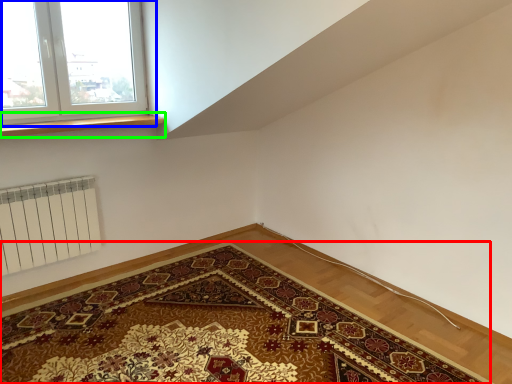
Question: Considering the real-world distances, which object is closest to mat (highlighted by a red box)? window (highlighted by a blue box) or window sill (highlighted by a green box).

Choices:
 (A) window
 (B) window sill

Answer: (B)